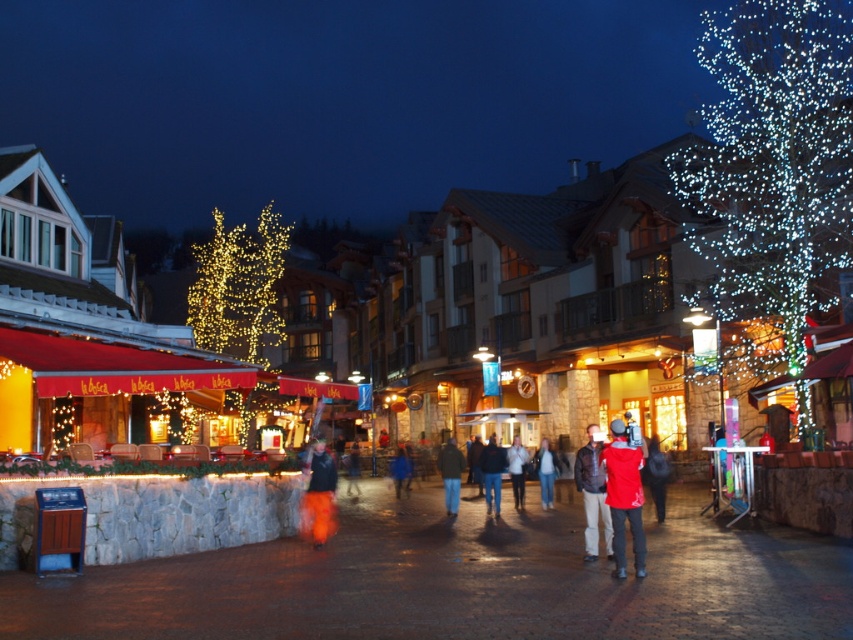
You are standing at the entrance of the shops on the left side of the image. You want to find the person wearing dark blue jeans at center. Based on their coordinates, in which direction should you look to spot them?

The dark blue jeans at center is located at point (492, 472), which means you should look towards the lower right direction from your position at the shops on the left side.

You are a photographer trying to capture a candid shot of the dark blue jeans at center and the white cotton jacket at center. Since you want to focus on both subjects equally, which clothing item should you zoom in on to ensure both fit in the frame without cropping?

Since the dark blue jeans at center is narrower than the white cotton jacket at center, you should zoom in on the white cotton jacket at center to ensure both fit in the frame without cropping.